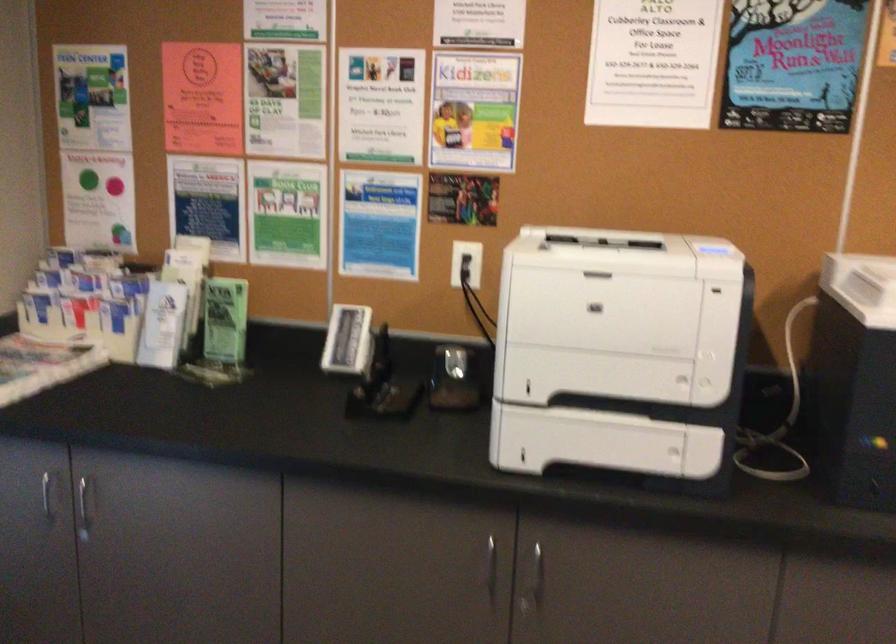
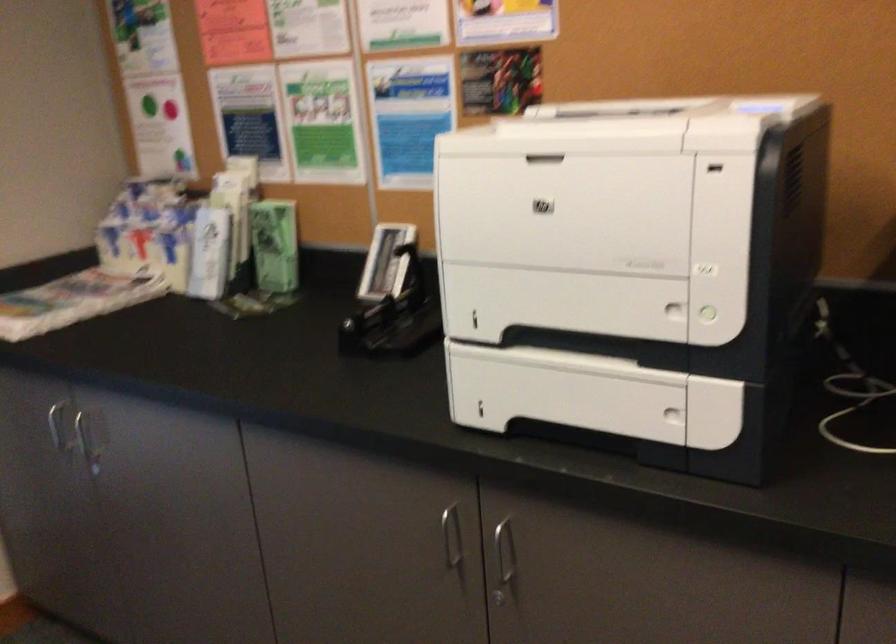
Which direction would the cameraman need to move to produce the second image?

The cameraman walked toward right, forward.